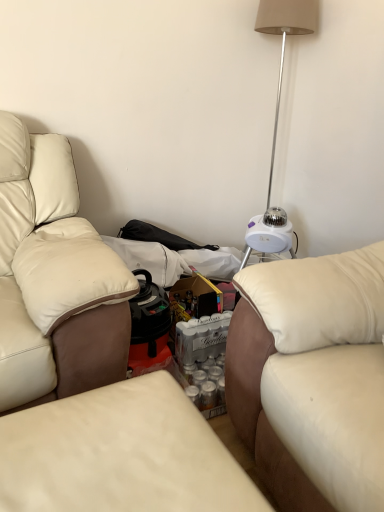
Find the location of a particular element. This screenshot has height=512, width=384. leather couch at center, marked as the second studio couch in a right-to-left arrangement is located at coordinates (120, 454).

This screenshot has width=384, height=512. In order to click on white leather studio couch at right, the second studio couch viewed from the left in this screenshot , I will do `click(312, 377)`.

Identify the location of leather couch at center, which ranks as the 1th studio couch in left-to-right order. (120, 454).

Between leather couch at center, marked as the second studio couch in a right-to-left arrangement, and white leather studio couch at right, the first studio couch in the right-to-left sequence, which one has smaller size?

With smaller size is leather couch at center, marked as the second studio couch in a right-to-left arrangement.

Is leather couch at center, marked as the second studio couch in a right-to-left arrangement, next to white leather studio couch at right, the first studio couch in the right-to-left sequence, and touching it?

There is a gap between leather couch at center, marked as the second studio couch in a right-to-left arrangement, and white leather studio couch at right, the first studio couch in the right-to-left sequence.

Considering the sizes of leather couch at center, which ranks as the 1th studio couch in left-to-right order, and white leather studio couch at right, the first studio couch in the right-to-left sequence, in the image, is leather couch at center, which ranks as the 1th studio couch in left-to-right order, taller or shorter than white leather studio couch at right, the first studio couch in the right-to-left sequence,?

Clearly, leather couch at center, which ranks as the 1th studio couch in left-to-right order, is shorter compared to white leather studio couch at right, the first studio couch in the right-to-left sequence.

I want to click on table lamp that appears above the leather couch at center, which ranks as the 1th studio couch in left-to-right order (from a real-world perspective), so click(x=281, y=82).

Does white plastic table lamp at upper right have a smaller size compared to leather couch at center, marked as the second studio couch in a right-to-left arrangement?

Actually, white plastic table lamp at upper right might be larger than leather couch at center, marked as the second studio couch in a right-to-left arrangement.

From the picture: From a real-world perspective, who is located higher, white plastic table lamp at upper right or leather couch at center, marked as the second studio couch in a right-to-left arrangement?

In real-world perspective, white plastic table lamp at upper right is above.

Is point (264, 251) in front of point (138, 423)?

No, it is not.

Is white leather studio couch at right, the first studio couch in the right-to-left sequence, completely or partially outside of white plastic table lamp at upper right?

Indeed, white leather studio couch at right, the first studio couch in the right-to-left sequence, is completely outside white plastic table lamp at upper right.

In the image, is white leather studio couch at right, the second studio couch viewed from the left, on the left side or the right side of white plastic table lamp at upper right?

white leather studio couch at right, the second studio couch viewed from the left, is to the right of white plastic table lamp at upper right.

Who is bigger, white leather studio couch at right, the first studio couch in the right-to-left sequence, or white plastic table lamp at upper right?

Bigger between the two is white leather studio couch at right, the first studio couch in the right-to-left sequence.

Is white plastic table lamp at upper right positioned beyond the bounds of white leather studio couch at right, the second studio couch viewed from the left?

white plastic table lamp at upper right lies outside white leather studio couch at right, the second studio couch viewed from the left,'s area.

Is white plastic table lamp at upper right positioned far away from white leather studio couch at right, the first studio couch in the right-to-left sequence?

Yes, white plastic table lamp at upper right is far from white leather studio couch at right, the first studio couch in the right-to-left sequence.

From the picture: Considering the relative positions of white plastic table lamp at upper right and white leather studio couch at right, the second studio couch viewed from the left, in the image provided, is white plastic table lamp at upper right to the left or to the right of white leather studio couch at right, the second studio couch viewed from the left,?

In the image, white plastic table lamp at upper right appears on the left side of white leather studio couch at right, the second studio couch viewed from the left.

From a real-world perspective, which is physically above, leather couch at center, which ranks as the 1th studio couch in left-to-right order, or white plastic table lamp at upper right?

From a 3D spatial view, white plastic table lamp at upper right is above.

Does point (164, 459) lie in front of point (279, 95)?

Yes, point (164, 459) is in front of point (279, 95).

Between leather couch at center, which ranks as the 1th studio couch in left-to-right order, and white plastic table lamp at upper right, which one has more height?

white plastic table lamp at upper right is taller.

Relative to leather couch at center, marked as the second studio couch in a right-to-left arrangement, is white leather studio couch at right, the second studio couch viewed from the left, in front or behind?

white leather studio couch at right, the second studio couch viewed from the left, is behind leather couch at center, marked as the second studio couch in a right-to-left arrangement.

From a real-world perspective, is white leather studio couch at right, the second studio couch viewed from the left, located higher than leather couch at center, which ranks as the 1th studio couch in left-to-right order?

Indeed, from a real-world perspective, white leather studio couch at right, the second studio couch viewed from the left, stands above leather couch at center, which ranks as the 1th studio couch in left-to-right order.

Is white leather studio couch at right, the first studio couch in the right-to-left sequence, not within leather couch at center, which ranks as the 1th studio couch in left-to-right order?

Yes, white leather studio couch at right, the first studio couch in the right-to-left sequence, is located beyond the bounds of leather couch at center, which ranks as the 1th studio couch in left-to-right order.

Can you tell me how much white leather studio couch at right, the first studio couch in the right-to-left sequence, and leather couch at center, marked as the second studio couch in a right-to-left arrangement, differ in facing direction?

93.1 degrees separate the facing orientations of white leather studio couch at right, the first studio couch in the right-to-left sequence, and leather couch at center, marked as the second studio couch in a right-to-left arrangement.

I want to click on studio couch above the leather couch at center, which ranks as the 1th studio couch in left-to-right order (from a real-world perspective), so click(x=312, y=377).

Where is `table lamp lying on the right of leather couch at center, marked as the second studio couch in a right-to-left arrangement`? Image resolution: width=384 pixels, height=512 pixels. table lamp lying on the right of leather couch at center, marked as the second studio couch in a right-to-left arrangement is located at coordinates (281, 82).

Which object lies nearer to the anchor point white plastic table lamp at upper right, white leather studio couch at right, the second studio couch viewed from the left, or leather couch at center, marked as the second studio couch in a right-to-left arrangement?

Based on the image, white leather studio couch at right, the second studio couch viewed from the left, appears to be nearer to white plastic table lamp at upper right.

When comparing their distances from leather couch at center, which ranks as the 1th studio couch in left-to-right order, does white leather studio couch at right, the first studio couch in the right-to-left sequence, or white plastic table lamp at upper right seem closer?

white leather studio couch at right, the first studio couch in the right-to-left sequence, is closer to leather couch at center, which ranks as the 1th studio couch in left-to-right order.

Considering their positions, is leather couch at center, which ranks as the 1th studio couch in left-to-right order, positioned further to white leather studio couch at right, the first studio couch in the right-to-left sequence, than white plastic table lamp at upper right?

white plastic table lamp at upper right lies further to white leather studio couch at right, the first studio couch in the right-to-left sequence, than the other object.

Considering their positions, is white plastic table lamp at upper right positioned closer to white leather studio couch at right, the first studio couch in the right-to-left sequence, than leather couch at center, which ranks as the 1th studio couch in left-to-right order?

Among the two, leather couch at center, which ranks as the 1th studio couch in left-to-right order, is located nearer to white leather studio couch at right, the first studio couch in the right-to-left sequence.

Estimate the real-world distances between objects in this image. Which object is further from white plastic table lamp at upper right, leather couch at center, which ranks as the 1th studio couch in left-to-right order, or white leather studio couch at right, the first studio couch in the right-to-left sequence?

Among the two, leather couch at center, which ranks as the 1th studio couch in left-to-right order, is located further to white plastic table lamp at upper right.

Considering their positions, is white plastic table lamp at upper right positioned further to leather couch at center, marked as the second studio couch in a right-to-left arrangement, than white leather studio couch at right, the first studio couch in the right-to-left sequence?

white plastic table lamp at upper right is positioned further to the anchor leather couch at center, marked as the second studio couch in a right-to-left arrangement.

The image size is (384, 512). Identify the location of studio couch located between leather couch at center, which ranks as the 1th studio couch in left-to-right order, and white plastic table lamp at upper right in the depth direction. (312, 377).